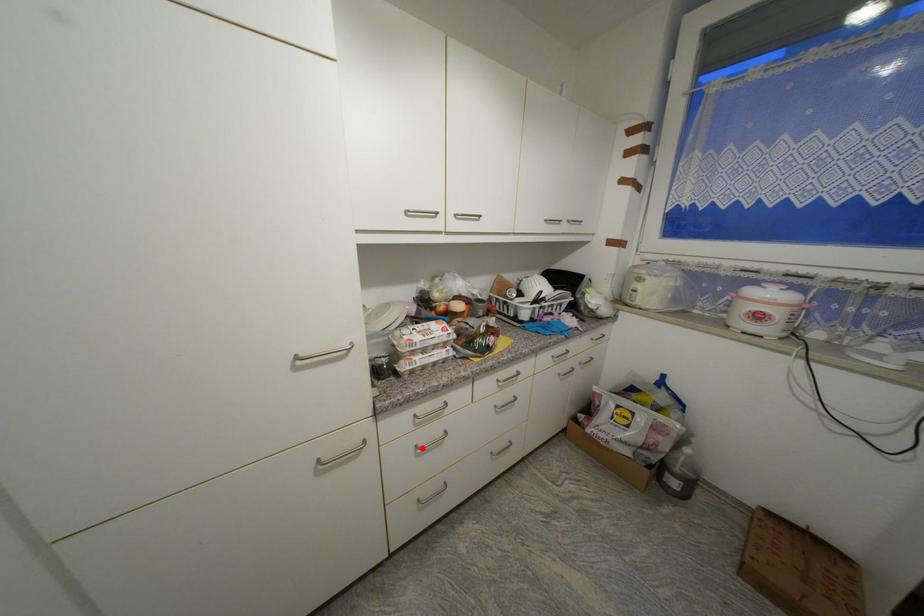
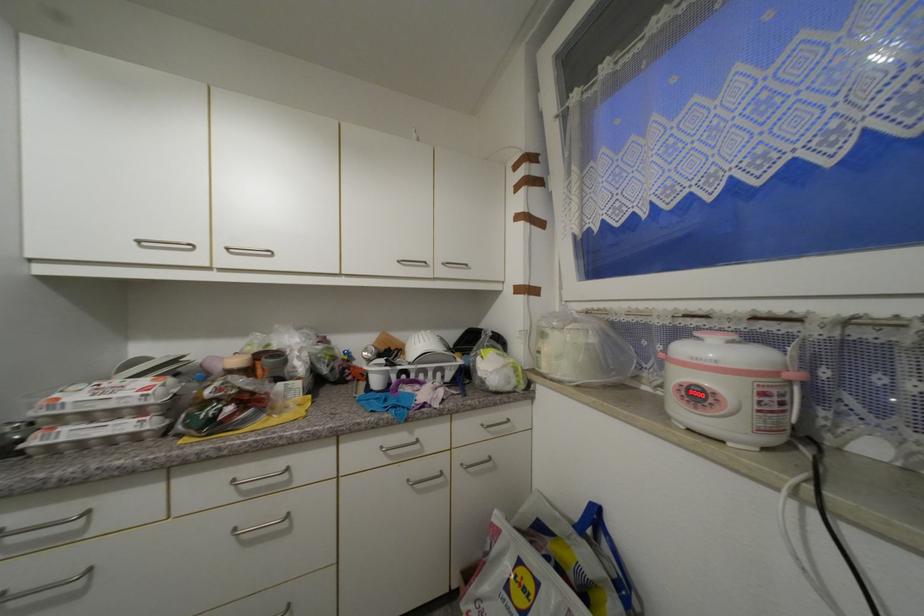
In the second image, find the point that corresponds to the highlighted location in the first image.

(6, 597)